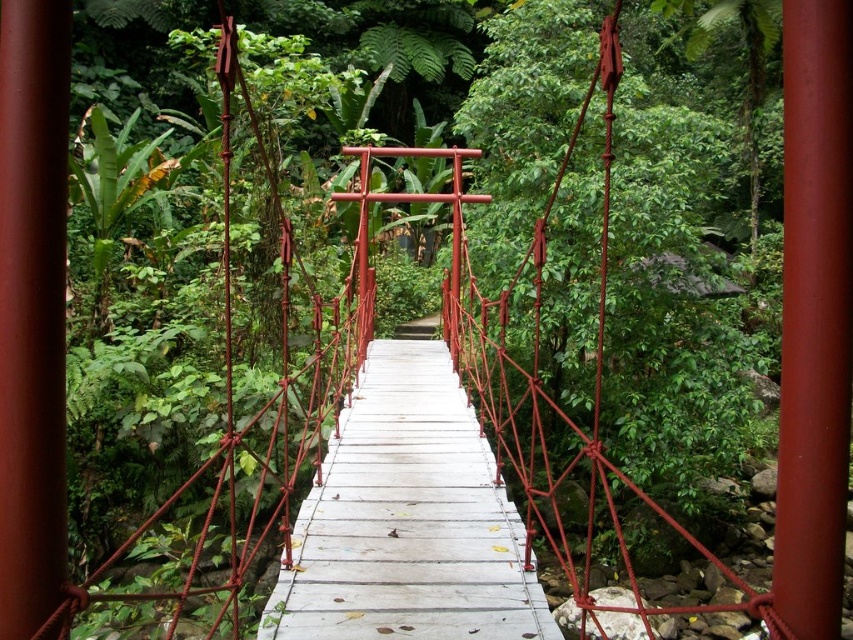
Between smooth glossy red pole at center and smooth red pole at center, which one is positioned lower?

smooth glossy red pole at center

Who is more forward, (811, 396) or (61, 284)?

Positioned in front is point (811, 396).

Find the location of a particular element. This screenshot has width=853, height=640. smooth glossy red pole at center is located at coordinates (814, 316).

Where is `smooth glossy red pole at center`? The height and width of the screenshot is (640, 853). smooth glossy red pole at center is located at coordinates (814, 316).

Is white wooden bridge at center behind smooth glossy red pole at center?

That is True.

The image size is (853, 640). Describe the element at coordinates (407, 518) in the screenshot. I see `white wooden bridge at center` at that location.

Identify the location of white wooden bridge at center. (407, 518).

Between point (374, 401) and point (0, 157), which one is positioned behind?

The point (374, 401) is more distant.

Describe the element at coordinates (407, 518) in the screenshot. I see `white wooden bridge at center` at that location.

Identify the location of white wooden bridge at center. (407, 518).